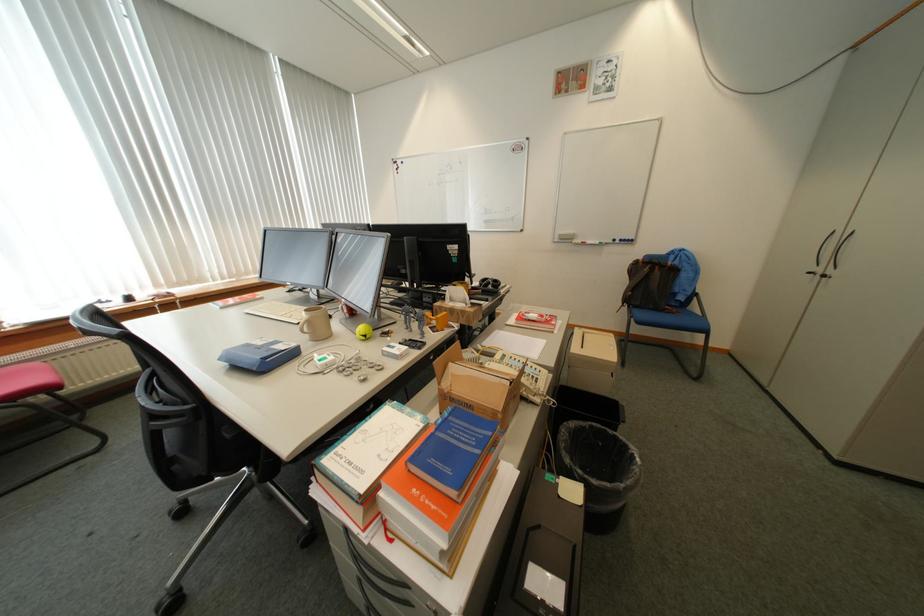
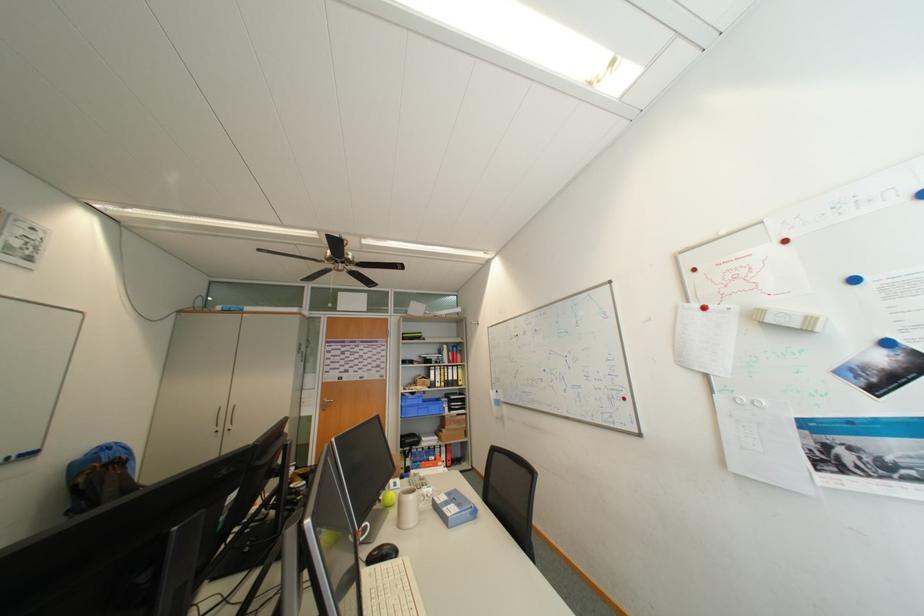
In the second image, find the point that corresponds to pixel 829 270 in the first image.

(229, 429)